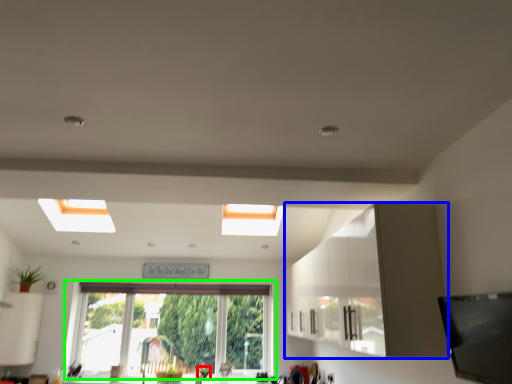
Question: Which object is the farthest from plant (highlighted by a red box)? Choose among these: cabinetry (highlighted by a blue box) or window (highlighted by a green box).

Choices:
 (A) cabinetry
 (B) window

Answer: (A)